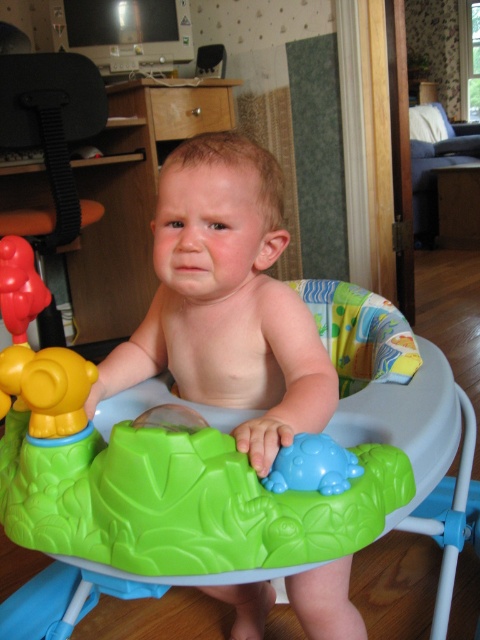
Question: Which object is farther from the camera taking this photo?

Choices:
 (A) velvet blue couch at upper right
 (B) black plastic feeding chair at left
 (C) blue rubber turtle at center
 (D) smooth plastic walker at center

Answer: (A)

Question: Which of the following is the closest to the observer?

Choices:
 (A) (49, 308)
 (B) (437, 122)
 (C) (250, 307)
 (D) (303, 467)

Answer: (D)

Question: Which is nearer to the black plastic feeding chair at left?

Choices:
 (A) velvet blue couch at upper right
 (B) smooth plastic walker at center

Answer: (B)

Question: Is smooth plastic walker at center thinner than velvet blue couch at upper right?

Choices:
 (A) no
 (B) yes

Answer: (B)

Question: Is smooth plastic walker at center thinner than velvet blue couch at upper right?

Choices:
 (A) no
 (B) yes

Answer: (B)

Question: Where is black plastic feeding chair at left located in relation to velvet blue couch at upper right in the image?

Choices:
 (A) right
 (B) left

Answer: (B)